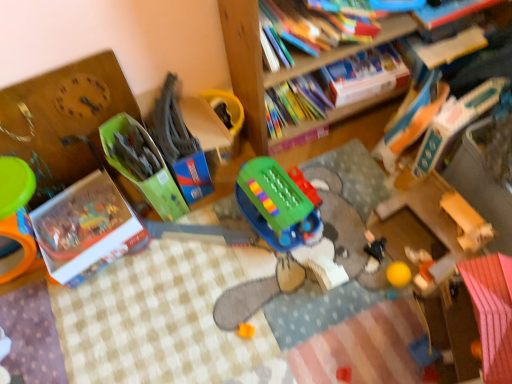
Where is `free space to the back side of rubberized orange ball at lower right, which is the first toy in right-to-left order`? This screenshot has height=384, width=512. free space to the back side of rubberized orange ball at lower right, which is the first toy in right-to-left order is located at coordinates (394, 227).